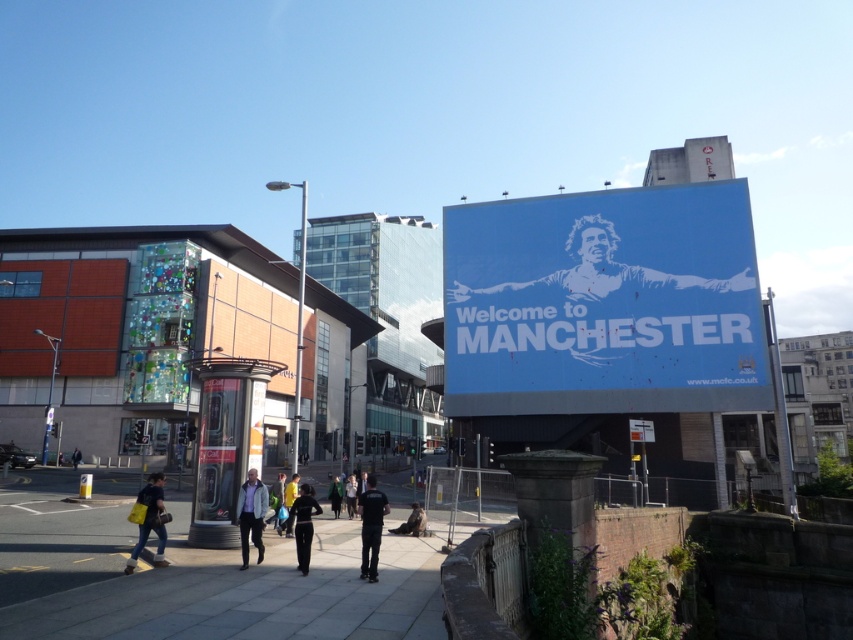
Question: Among these points, which one is farthest from the camera?

Choices:
 (A) (287, 484)
 (B) (712, 273)

Answer: (B)

Question: Is blue painted figure at upper center thinner than brown leather jacket at lower center?

Choices:
 (A) no
 (B) yes

Answer: (A)

Question: Among these points, which one is nearest to the camera?

Choices:
 (A) click(x=306, y=509)
 (B) click(x=592, y=224)
 (C) click(x=363, y=572)
 (D) click(x=0, y=586)

Answer: (D)

Question: Is smooth concrete pavement at center positioned before dark blue jacket at center?

Choices:
 (A) no
 (B) yes

Answer: (B)

Question: Which object appears closest to the camera in this image?

Choices:
 (A) light gray jacket at center
 (B) blue painted figure at upper center
 (C) dark green jacket at center
 (D) blue matte signboard at upper center

Answer: (A)

Question: Observing the image, what is the correct spatial positioning of blue painted figure at upper center in reference to dark blue jeans at center?

Choices:
 (A) above
 (B) below

Answer: (A)